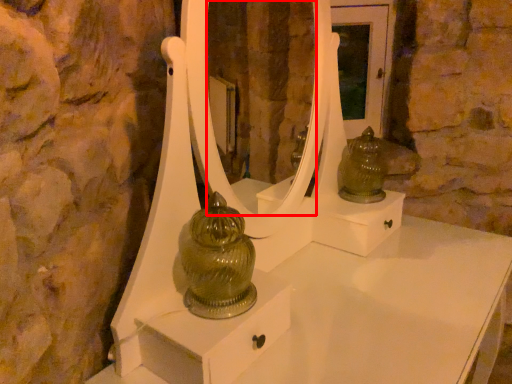
Question: From the image, what is the correct spatial relationship of mirror (annotated by the red box) in relation to figurine?

Choices:
 (A) right
 (B) left

Answer: (B)